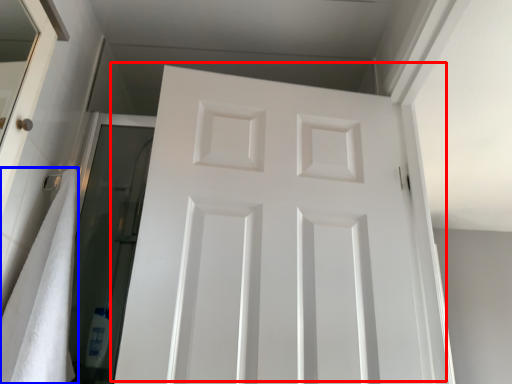
Question: Among these objects, which one is nearest to the camera, door (highlighted by a red box) or bath towel (highlighted by a blue box)?

Choices:
 (A) door
 (B) bath towel

Answer: (B)